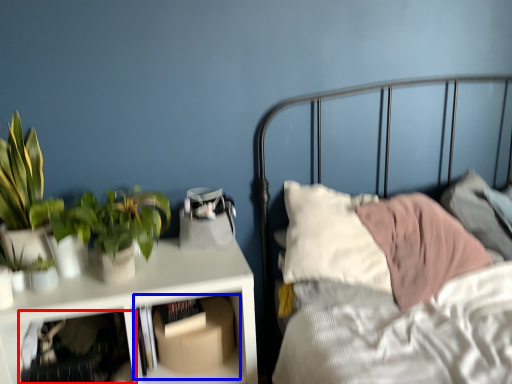
Question: Which point is closer to the camera, shelf (highlighted by a red box) or shelf (highlighted by a blue box)?

Choices:
 (A) shelf
 (B) shelf

Answer: (A)